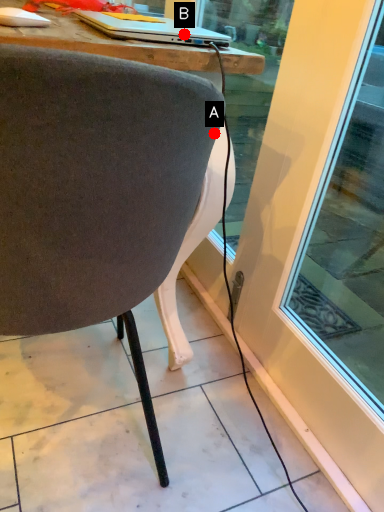
Question: Two points are circled on the image, labeled by A and B beside each circle. Which point is farther to the camera?

Choices:
 (A) A is further
 (B) B is further

Answer: (B)